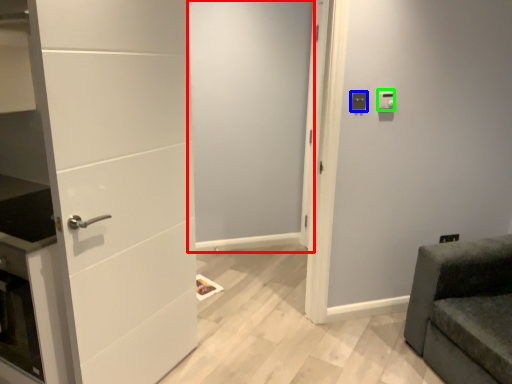
Question: Which is farther away from screen door (highlighted by a red box)? light switch (highlighted by a blue box) or light switch (highlighted by a green box)?

Choices:
 (A) light switch
 (B) light switch

Answer: (B)